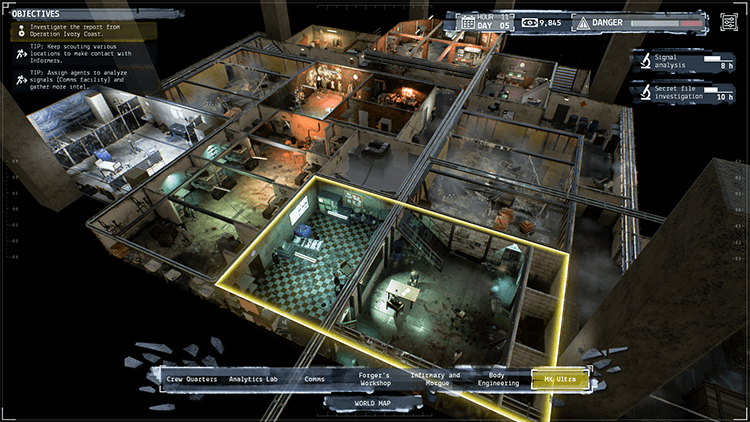
The width and height of the screenshot is (750, 422). In order to click on tiled floor in this screenshot , I will do (x=308, y=289).